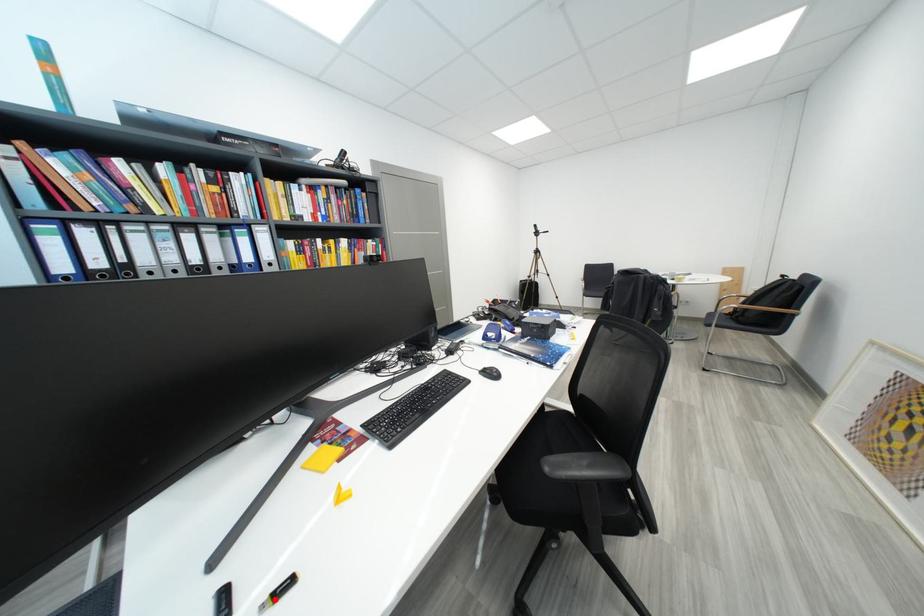
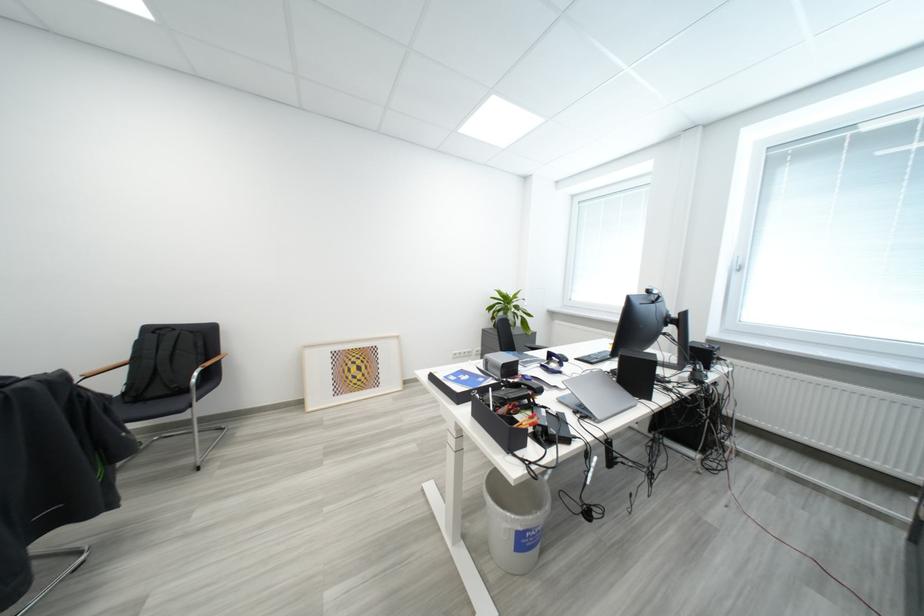
Question: I am providing you with two images of the same scene from different viewpoints. A red point is marked on the first image. At the location where the point appears in image 1, is it still visible in image 2?

Choices:
 (A) Yes
 (B) No

Answer: (B)